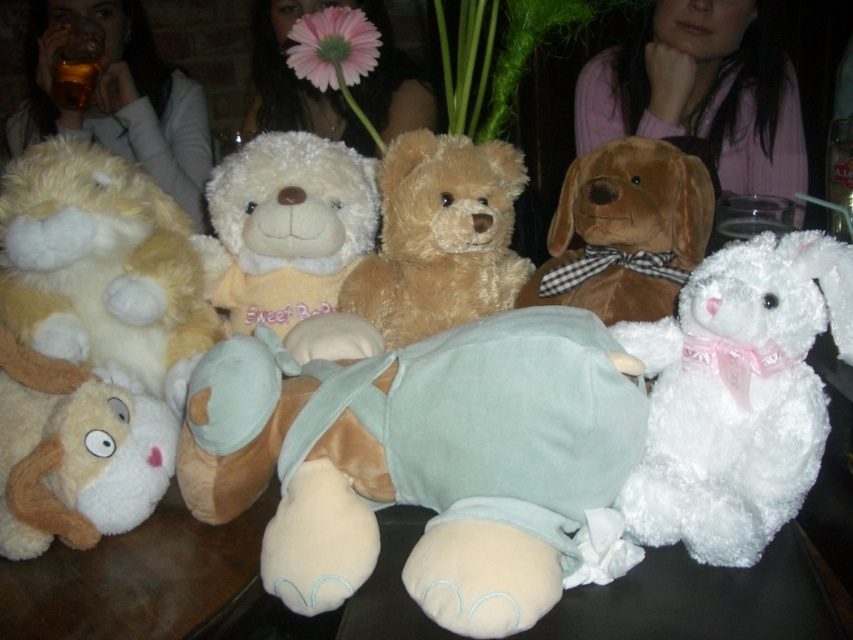
You are organizing a toy store display and need to arrange the light blue plush toy at center and the fluffy beige teddy bear at left according to their positions. Which toy is positioned to the left side of the display?

The fluffy beige teddy bear at left is positioned to the left side of the display, while the light blue plush toy at center is to its right.

You are a child trying to decide which plush toy to choose for a gift. The light blue plush toy at center and the fluffy beige teddy bear at left are both options. Which one is bigger?

The light blue plush toy at center is larger in size than the fluffy beige teddy bear at left, so it is the bigger option between the two.